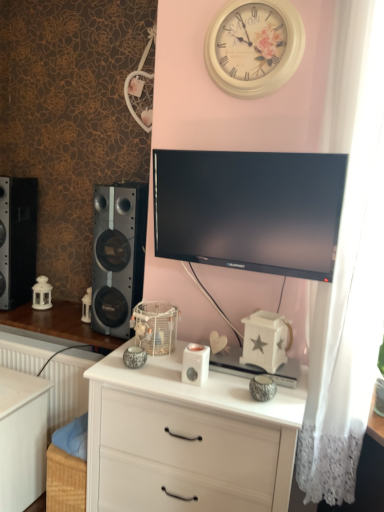
Where is `white wood changing table at lower left`? This screenshot has width=384, height=512. white wood changing table at lower left is located at coordinates (22, 438).

Find the location of a particular element. The image size is (384, 512). white lace curtain at right is located at coordinates (348, 264).

What is the approximate width of wooden table at left?

It is 20.23 inches.

Describe the element at coordinates (250, 210) in the screenshot. The width and height of the screenshot is (384, 512). I see `black glossy tv at center` at that location.

Measure the distance between black glossy tv at center and camera.

They are 1.43 meters apart.

Where is `white wood changing table at lower left`? The image size is (384, 512). white wood changing table at lower left is located at coordinates (22, 438).

Who is taller, white wood changing table at lower left or black glossy tv at center?

white wood changing table at lower left is taller.

From a real-world perspective, between white wood changing table at lower left and black glossy tv at center, who is vertically lower?

white wood changing table at lower left.

Measure the distance from white wood changing table at lower left to black glossy tv at center.

1.22 meters.

From the image's perspective, who appears lower, white wood changing table at lower left or black glossy tv at center?

white wood changing table at lower left is shown below in the image.

Considering the relative sizes of white wooden clock at upper center and white lace curtain at right in the image provided, is white wooden clock at upper center shorter than white lace curtain at right?

Yes.

Based on the photo, from a real-world perspective, which object rests below the other?

white lace curtain at right, from a real-world perspective.

Is white wooden clock at upper center outside of white lace curtain at right?

white wooden clock at upper center lies outside white lace curtain at right's area.

Can you see white wooden clock at upper center touching white lace curtain at right?

No, white wooden clock at upper center is not next to white lace curtain at right.

Is black matte speaker at left, the 2th speaker when ordered from left to right, positioned far away from wooden table at left?

No.

Is black matte speaker at left, the first speaker from the right, to the right of wooden table at left from the viewer's perspective?

Yes.

Is the position of black matte speaker at left, the 2th speaker when ordered from left to right, less distant than that of wooden table at left?

Yes, black matte speaker at left, the 2th speaker when ordered from left to right, is closer to the camera.

Is black glossy tv at center positioned before white wood chest of drawers at center?

No, it is not.

Considering the relative positions of black glossy tv at center and white wood chest of drawers at center in the image provided, is black glossy tv at center to the left of white wood chest of drawers at center from the viewer's perspective?

In fact, black glossy tv at center is to the right of white wood chest of drawers at center.

From the picture: Can you confirm if black glossy tv at center is thinner than white wood chest of drawers at center?

Indeed, black glossy tv at center has a lesser width compared to white wood chest of drawers at center.

Does black glossy tv at center have a smaller size compared to white wood chest of drawers at center?

Yes.

From the image's perspective, is white plastic ipod at center on white wooden clock at upper center?

No.

Is white plastic ipod at center oriented towards white wooden clock at upper center?

No, white plastic ipod at center does not turn towards white wooden clock at upper center.

Which of these two, white plastic ipod at center or white wooden clock at upper center, is bigger?

With larger size is white wooden clock at upper center.

From a real-world perspective, is white plastic ipod at center located higher than white wooden clock at upper center?

Actually, white plastic ipod at center is physically below white wooden clock at upper center in the real world.

Can you tell me how much black matte speaker at left, the first speaker from the right, and black matte speaker at left, the first speaker in the left-to-right sequence, differ in facing direction?

There is a 18.5-degree angle between the facing directions of black matte speaker at left, the first speaker from the right, and black matte speaker at left, the first speaker in the left-to-right sequence.

Is black matte speaker at left, the 2th speaker when ordered from left to right, next to black matte speaker at left, acting as the second speaker starting from the right, and touching it?

black matte speaker at left, the 2th speaker when ordered from left to right, and black matte speaker at left, acting as the second speaker starting from the right, are not in contact.

Identify the location of speaker on the right of black matte speaker at left, the first speaker in the left-to-right sequence. (118, 255).

From a real-world perspective, between black matte speaker at left, the first speaker from the right, and black matte speaker at left, the first speaker in the left-to-right sequence, who is vertically lower?

In real-world perspective, black matte speaker at left, the first speaker from the right, is lower.

Is white wood changing table at lower left taller or shorter than white plastic ipod at center?

white wood changing table at lower left is taller than white plastic ipod at center.

In terms of size, does white wood changing table at lower left appear bigger or smaller than white plastic ipod at center?

Considering their sizes, white wood changing table at lower left takes up more space than white plastic ipod at center.

Is the position of white wood changing table at lower left less distant than that of white plastic ipod at center?

That is False.

Where is `ipod in front of the white wood changing table at lower left`? The image size is (384, 512). ipod in front of the white wood changing table at lower left is located at coordinates (195, 364).

The image size is (384, 512). What are the coordinates of `changing table lying on the left of black glossy tv at center` in the screenshot? It's located at (22, 438).

At what (x,y) coordinates should I click in order to perform the action: click on curtain located on the right of white wooden clock at upper center. Please return your answer as a coordinate pair (x, y). The width and height of the screenshot is (384, 512). Looking at the image, I should click on (348, 264).

Based on their spatial positions, is white wooden clock at upper center or white plastic ipod at center closer to black matte speaker at left, acting as the second speaker starting from the right?

white plastic ipod at center lies closer to black matte speaker at left, acting as the second speaker starting from the right, than the other object.

Considering their positions, is white wooden clock at upper center positioned closer to black glossy tv at center than white wood changing table at lower left?

white wooden clock at upper center is closer to black glossy tv at center.

Estimate the real-world distances between objects in this image. Which object is further from white wooden clock at upper center, wooden table at left or black matte speaker at left, the first speaker from the right?

wooden table at left is positioned further to the anchor white wooden clock at upper center.

Considering their positions, is black matte speaker at left, the first speaker from the right, positioned closer to black glossy tv at center than white wood chest of drawers at center?

The object closer to black glossy tv at center is black matte speaker at left, the first speaker from the right.

Looking at the image, which one is located closer to white wood changing table at lower left, white wood chest of drawers at center or black matte speaker at left, the first speaker from the right?

white wood chest of drawers at center lies closer to white wood changing table at lower left than the other object.

Looking at the image, which one is located further to white plastic ipod at center, white lace curtain at right or black matte speaker at left, acting as the second speaker starting from the right?

black matte speaker at left, acting as the second speaker starting from the right, is positioned further to the anchor white plastic ipod at center.

Considering their positions, is black matte speaker at left, the first speaker from the right, positioned further to white wood chest of drawers at center than white plastic ipod at center?

Based on the image, black matte speaker at left, the first speaker from the right, appears to be further to white wood chest of drawers at center.

Estimate the real-world distances between objects in this image. Which object is closer to white wood chest of drawers at center, white lace curtain at right or black matte speaker at left, acting as the second speaker starting from the right?

white lace curtain at right is closer to white wood chest of drawers at center.

You are a GUI agent. You are given a task and a screenshot of the screen. Output one action in this format:
    pyautogui.click(x=<x>, y=<y>)
    Task: Click on the ipod situated between wooden table at left and white wood chest of drawers at center from left to right
    The image size is (384, 512).
    Given the screenshot: What is the action you would take?
    pyautogui.click(x=195, y=364)

Locate an element on the screen. Image resolution: width=384 pixels, height=512 pixels. television between white wooden clock at upper center and black matte speaker at left, the 2th speaker when ordered from left to right, in the vertical direction is located at coordinates (250, 210).

Image resolution: width=384 pixels, height=512 pixels. Find the location of `speaker situated between black matte speaker at left, the first speaker in the left-to-right sequence, and white plastic ipod at center from left to right`. speaker situated between black matte speaker at left, the first speaker in the left-to-right sequence, and white plastic ipod at center from left to right is located at coordinates (118, 255).

Locate an element on the screen. The image size is (384, 512). curtain between white wooden clock at upper center and white plastic ipod at center in the vertical direction is located at coordinates (348, 264).